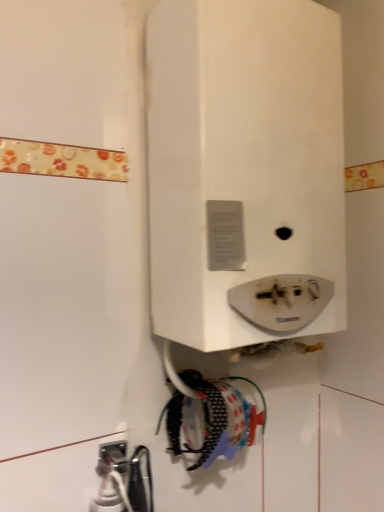
The width and height of the screenshot is (384, 512). What are the coordinates of `white plastic light switch at center` in the screenshot? It's located at (245, 166).

Describe the element at coordinates (245, 166) in the screenshot. I see `white plastic light switch at center` at that location.

Locate an element on the screen. The height and width of the screenshot is (512, 384). white plastic light switch at center is located at coordinates (245, 166).